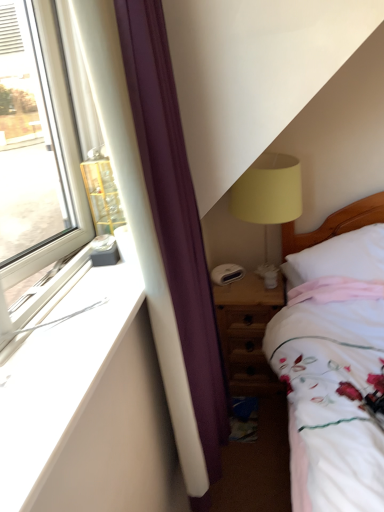
Question: Does white soft pillow at right touch white smooth window sill at left?

Choices:
 (A) yes
 (B) no

Answer: (B)

Question: From a real-world perspective, is white soft pillow at right over white smooth window sill at left?

Choices:
 (A) no
 (B) yes

Answer: (A)

Question: Is white soft pillow at right taller than white smooth window sill at left?

Choices:
 (A) yes
 (B) no

Answer: (A)

Question: Is white soft pillow at right to the left of white smooth window sill at left from the viewer's perspective?

Choices:
 (A) no
 (B) yes

Answer: (A)

Question: Would you say white smooth window sill at left is part of white soft pillow at right's contents?

Choices:
 (A) no
 (B) yes

Answer: (A)

Question: Could you tell me if white soft pillow at right is facing white smooth window sill at left?

Choices:
 (A) yes
 (B) no

Answer: (B)

Question: From the image's perspective, is white smooth window sill at left beneath white soft pillow at right?

Choices:
 (A) no
 (B) yes

Answer: (B)

Question: Does white smooth window sill at left lie behind white soft pillow at right?

Choices:
 (A) no
 (B) yes

Answer: (A)

Question: Is white smooth window sill at left looking in the opposite direction of white soft pillow at right?

Choices:
 (A) no
 (B) yes

Answer: (A)

Question: Can white soft pillow at right be found inside white smooth window sill at left?

Choices:
 (A) no
 (B) yes

Answer: (A)

Question: From a real-world perspective, is white smooth window sill at left below white soft pillow at right?

Choices:
 (A) no
 (B) yes

Answer: (A)

Question: Does white smooth window sill at left have a smaller size compared to white soft pillow at right?

Choices:
 (A) yes
 (B) no

Answer: (A)

Question: Is wooden nightstand at lower right bigger than white soft pillow at right?

Choices:
 (A) yes
 (B) no

Answer: (A)